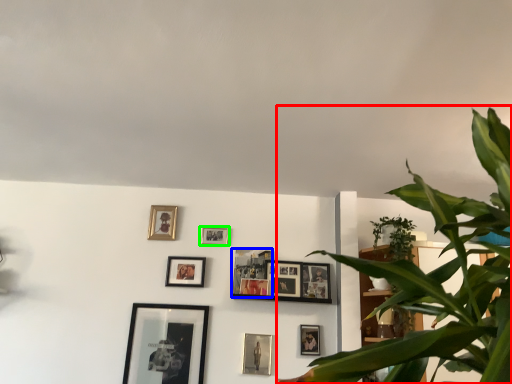
Question: Estimate the real-world distances between objects in this image. Which object is closer to houseplant (highlighted by a red box), picture frame (highlighted by a blue box) or picture frame (highlighted by a green box)?

Choices:
 (A) picture frame
 (B) picture frame

Answer: (A)